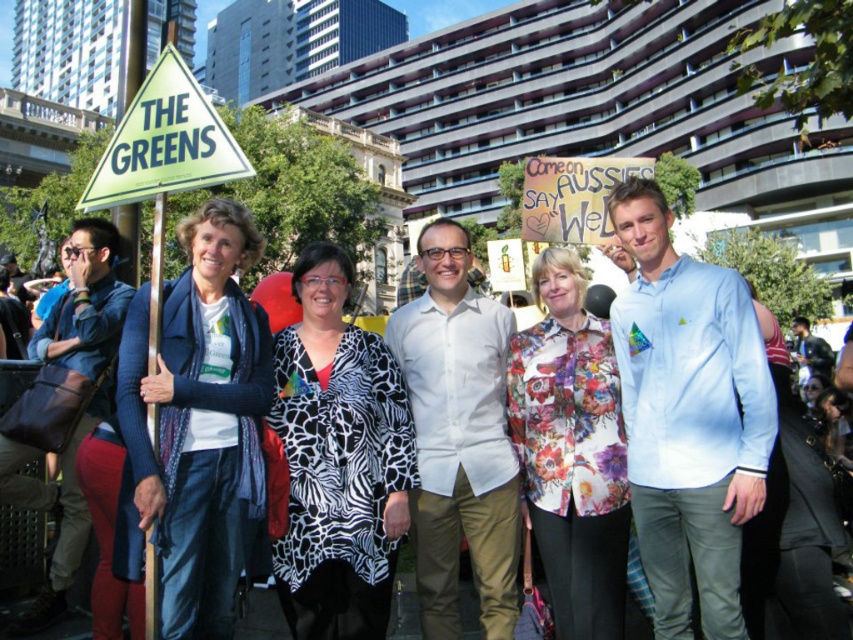
Question: Which object is the closest to the zebra print coat at center?

Choices:
 (A) floral print blouse at center
 (B) blue woolen scarf at left

Answer: (B)

Question: Is blue woolen scarf at left in front of zebra print coat at center?

Choices:
 (A) no
 (B) yes

Answer: (B)

Question: Which point appears closest to the camera in this image?

Choices:
 (A) (250, 486)
 (B) (303, 337)
 (C) (546, 376)

Answer: (A)

Question: Is zebra print coat at center closer to the viewer compared to floral print blouse at center?

Choices:
 (A) no
 (B) yes

Answer: (B)

Question: Considering the relative positions of blue woolen scarf at left and floral print blouse at center in the image provided, where is blue woolen scarf at left located with respect to floral print blouse at center?

Choices:
 (A) above
 (B) below

Answer: (A)

Question: Which point is farther to the camera?

Choices:
 (A) (358, 460)
 (B) (263, 531)

Answer: (A)